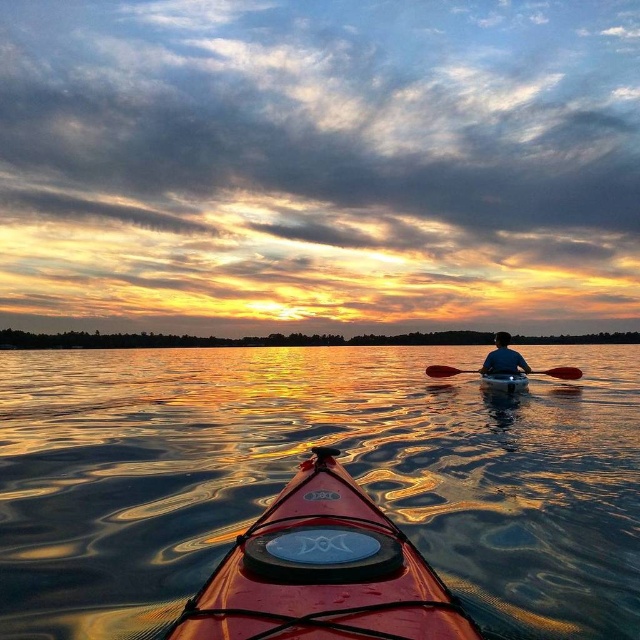
You are in a kayak and want to know the position of the shiny red kayak at center relative to the matte orange canoe at center. Which one is on the right side?

The shiny red kayak at center is to the left of the matte orange canoe at center, so the matte orange canoe at center is on the right side.

You are in a kayak and want to know if the glossy water at center is above or below the matte orange canoe at center. Based on the scene description, what is the relationship between their positions?

The glossy water at center is located below the matte orange canoe at center.

You are in a kayak and want to take a photo of the shiny red kayak at center and the glossy water at center. Which object should you focus on first if you want the other to be in the background?

You should focus on the shiny red kayak at center first because the glossy water at center is located below it and would naturally be in the background if the kayak is in focus.